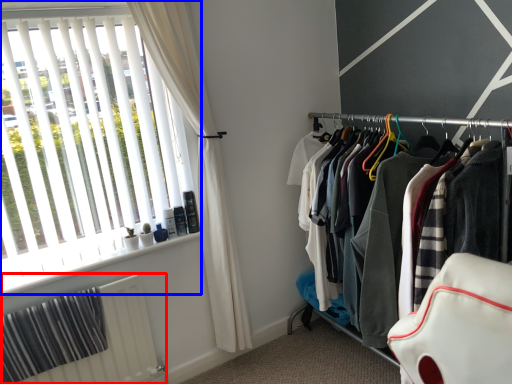
Question: Which object appears farthest to the camera in this image, radiator (highlighted by a red box) or window (highlighted by a blue box)?

Choices:
 (A) radiator
 (B) window

Answer: (A)